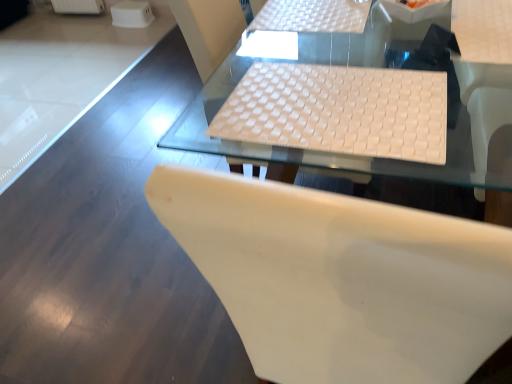
Question: Which direction should I rotate to face white woven mat at upper center, which is counted as the first table, starting from the top, — up or down?

Choices:
 (A) down
 (B) up

Answer: (B)

Question: In which direction should I rotate to look at white woven mat at center, which is counted as the first table, starting from the bottom?

Choices:
 (A) left
 (B) right

Answer: (B)

Question: Can you confirm if white matte chair at center is positioned to the right of white woven mat at upper center, which is counted as the first table, starting from the top?

Choices:
 (A) no
 (B) yes

Answer: (B)

Question: From a real-world perspective, is white matte chair at center physically below white woven mat at upper center, which is counted as the first table, starting from the top?

Choices:
 (A) no
 (B) yes

Answer: (B)

Question: From a real-world perspective, is white matte chair at center positioned over white woven mat at upper center, which is counted as the first table, starting from the top, based on gravity?

Choices:
 (A) yes
 (B) no

Answer: (B)

Question: Could white woven mat at upper center, which is counted as the first table, starting from the top, be considered to be inside white matte chair at center?

Choices:
 (A) no
 (B) yes

Answer: (B)

Question: Is white matte chair at center smaller than white woven mat at upper center, which is counted as the first table, starting from the top?

Choices:
 (A) no
 (B) yes

Answer: (A)

Question: Does white matte chair at center appear on the left side of white woven mat at upper center, which is counted as the second table, starting from the bottom?

Choices:
 (A) yes
 (B) no

Answer: (B)

Question: Is white woven mat at center, the second table in the top-to-bottom sequence, thinner than white matte chair at center?

Choices:
 (A) yes
 (B) no

Answer: (A)

Question: Does white woven mat at center, the second table in the top-to-bottom sequence, have a greater width compared to white matte chair at center?

Choices:
 (A) no
 (B) yes

Answer: (A)

Question: Does white woven mat at center, which is counted as the first table, starting from the bottom, have a larger size compared to white matte chair at center?

Choices:
 (A) yes
 (B) no

Answer: (B)

Question: Does white woven mat at center, the second table in the top-to-bottom sequence, have a greater height compared to white matte chair at center?

Choices:
 (A) no
 (B) yes

Answer: (B)

Question: From a real-world perspective, is white woven mat at center, which is counted as the first table, starting from the bottom, below white matte chair at center?

Choices:
 (A) yes
 (B) no

Answer: (B)

Question: Is white woven mat at center, which is counted as the first table, starting from the bottom, further to the viewer compared to white matte chair at center?

Choices:
 (A) yes
 (B) no

Answer: (A)

Question: Does white woven mat at upper center, which is counted as the second table, starting from the bottom, lie behind white matte chair at center?

Choices:
 (A) yes
 (B) no

Answer: (A)